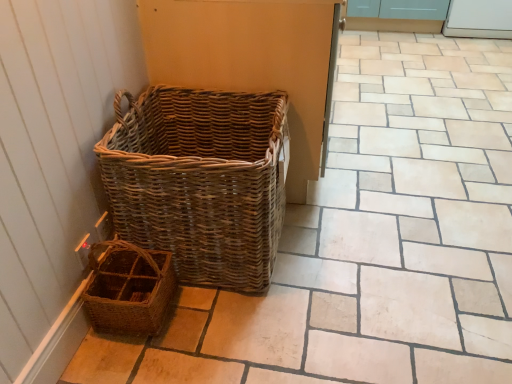
Question: From a real-world perspective, is natural wicker picnic basket at left, placed as the second picnic basket when sorted from bottom to top, under brown woven picnic basket at lower left, the second picnic basket in the top-to-bottom sequence?

Choices:
 (A) yes
 (B) no

Answer: (B)

Question: Does natural wicker picnic basket at left, which is the first picnic basket in top-to-bottom order, have a lesser height compared to brown woven picnic basket at lower left, acting as the 1th picnic basket starting from the bottom?

Choices:
 (A) yes
 (B) no

Answer: (B)

Question: From the image's perspective, is natural wicker picnic basket at left, which is the first picnic basket in top-to-bottom order, over brown woven picnic basket at lower left, acting as the 1th picnic basket starting from the bottom?

Choices:
 (A) yes
 (B) no

Answer: (A)

Question: Is natural wicker picnic basket at left, placed as the second picnic basket when sorted from bottom to top, turned away from brown woven picnic basket at lower left, the second picnic basket in the top-to-bottom sequence?

Choices:
 (A) no
 (B) yes

Answer: (A)

Question: Are natural wicker picnic basket at left, placed as the second picnic basket when sorted from bottom to top, and brown woven picnic basket at lower left, acting as the 1th picnic basket starting from the bottom, beside each other?

Choices:
 (A) no
 (B) yes

Answer: (A)

Question: Can you confirm if natural wicker picnic basket at left, placed as the second picnic basket when sorted from bottom to top, is positioned to the left of brown woven picnic basket at lower left, acting as the 1th picnic basket starting from the bottom?

Choices:
 (A) no
 (B) yes

Answer: (A)

Question: Can you confirm if natural wicker picnic basket at left, which is the first picnic basket in top-to-bottom order, is shorter than white glossy screen door at upper right?

Choices:
 (A) no
 (B) yes

Answer: (A)

Question: Does natural wicker picnic basket at left, placed as the second picnic basket when sorted from bottom to top, have a greater height compared to white glossy screen door at upper right?

Choices:
 (A) no
 (B) yes

Answer: (B)

Question: Is natural wicker picnic basket at left, which is the first picnic basket in top-to-bottom order, smaller than white glossy screen door at upper right?

Choices:
 (A) yes
 (B) no

Answer: (B)

Question: Does natural wicker picnic basket at left, which is the first picnic basket in top-to-bottom order, appear on the left side of white glossy screen door at upper right?

Choices:
 (A) yes
 (B) no

Answer: (A)

Question: Is natural wicker picnic basket at left, which is the first picnic basket in top-to-bottom order, turned away from white glossy screen door at upper right?

Choices:
 (A) no
 (B) yes

Answer: (A)

Question: Is natural wicker picnic basket at left, which is the first picnic basket in top-to-bottom order, thinner than white glossy screen door at upper right?

Choices:
 (A) yes
 (B) no

Answer: (A)

Question: Does white glossy screen door at upper right have a greater width compared to brown woven picnic basket at lower left, the second picnic basket in the top-to-bottom sequence?

Choices:
 (A) no
 (B) yes

Answer: (B)